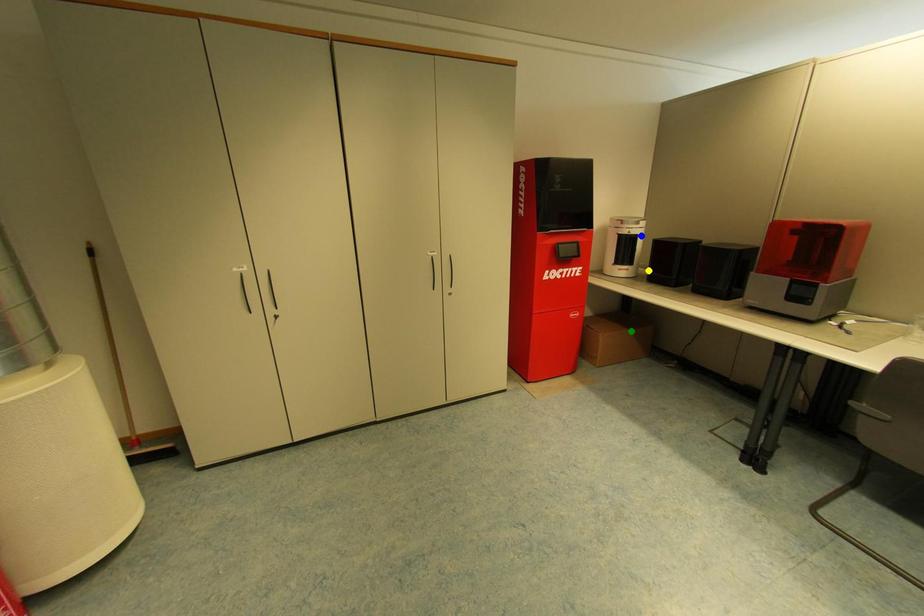
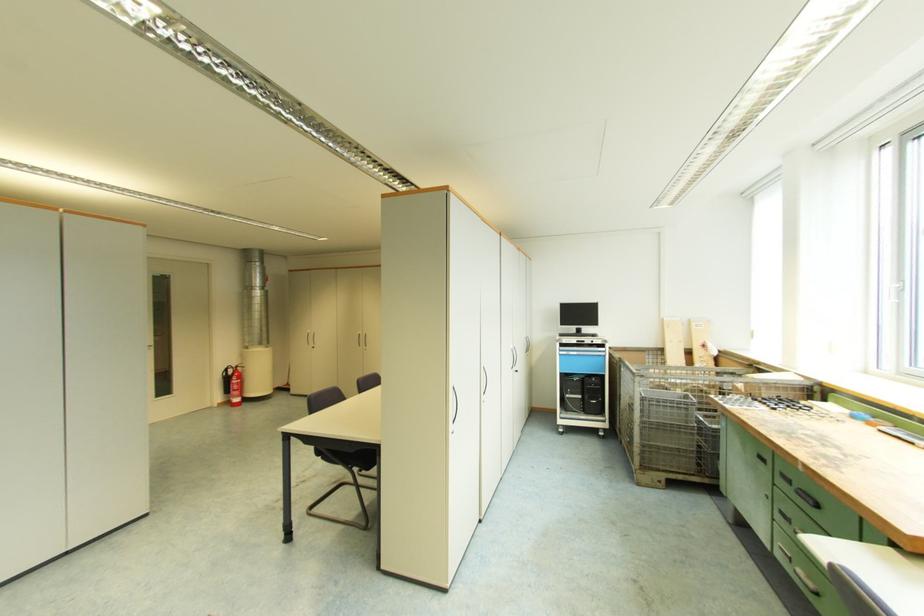
I am providing you with two images of the same scene from different viewpoints. Three points are marked in image1. Which point corresponds to a part or object that is occluded in image2?In image1, three points are marked. Which of them correspond to a part or object that is occluded in image2?Among the three points shown in image1, which one corresponds to a part or object that is no longer visible due to occlusion in image2?

green point, blue point, yellow point cannot be seen in image2.